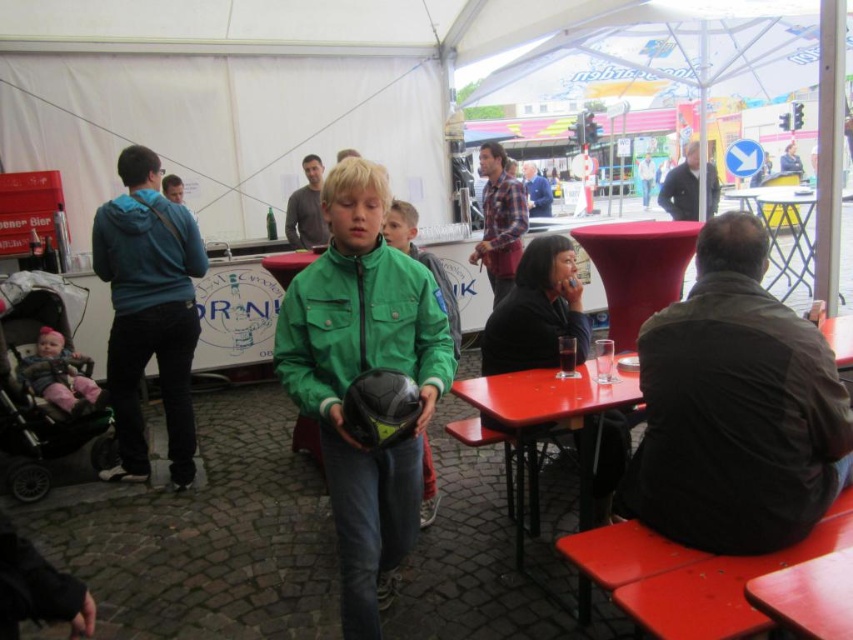
You are organizing a clothing display and need to place the dark brown leather jacket at right and the dark blue jacket at center on a narrow shelf. Which jacket should you place first to ensure they both fit?

The dark brown leather jacket at right is wider than the dark blue jacket at center, so you should place the wider dark brown leather jacket at right first to ensure both fit on the narrow shelf.

You are standing at the center of the cobblestone area under the tent. You see two points marked as point 1 at coordinates point (511, 184) and point 2 at coordinates point (183, 195). Which point is closer to you?

Point (511, 184) is closer to the camera than point (183, 195), so the point closer to you is point (511, 184).

You are standing at the center of the tent and want to hand a brochure to the person wearing the light blue fabric shirt at upper left. However, there is a matte plastic table at lower right in your way. Can you reach the person without moving the table?

The matte plastic table at lower right is in front of the light blue fabric shirt at upper left, so you cannot directly reach the person without moving the table.